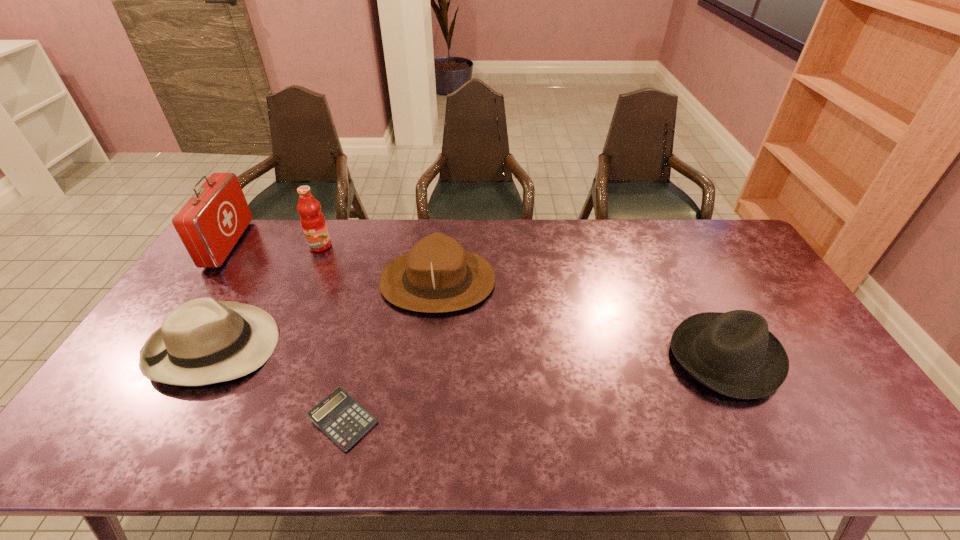
Find the location of a particular element. The image size is (960, 540). the first-aid kit is located at coordinates (211, 222).

You are a GUI agent. You are given a task and a screenshot of the screen. Output one action in this format:
    pyautogui.click(x=<x>, y=<y>)
    Task: Click on the fruit juice
    The height and width of the screenshot is (540, 960).
    Given the screenshot: What is the action you would take?
    pyautogui.click(x=313, y=222)

Where is `the third tallest object`? Image resolution: width=960 pixels, height=540 pixels. the third tallest object is located at coordinates (437, 275).

The height and width of the screenshot is (540, 960). Identify the location of the tallest fedora. coord(437,275).

You are a GUI agent. You are given a task and a screenshot of the screen. Output one action in this format:
    pyautogui.click(x=<x>, y=<y>)
    Task: Click on the leftmost fedora
    The height and width of the screenshot is (540, 960).
    Given the screenshot: What is the action you would take?
    pyautogui.click(x=202, y=342)

Locate an element on the screen. This screenshot has width=960, height=540. the rightmost object is located at coordinates (734, 353).

I want to click on the shortest object, so pos(339,416).

Locate an element on the screen. free space located 0.230m on the side of the first-aid kit with the first aid cross symbol is located at coordinates (303, 244).

Where is `free space located 0.070m on the front label of the fruit juice`? free space located 0.070m on the front label of the fruit juice is located at coordinates (312, 266).

Identify the location of vacant space positioned 0.390m on the feather side of the third tallest object. (615, 281).